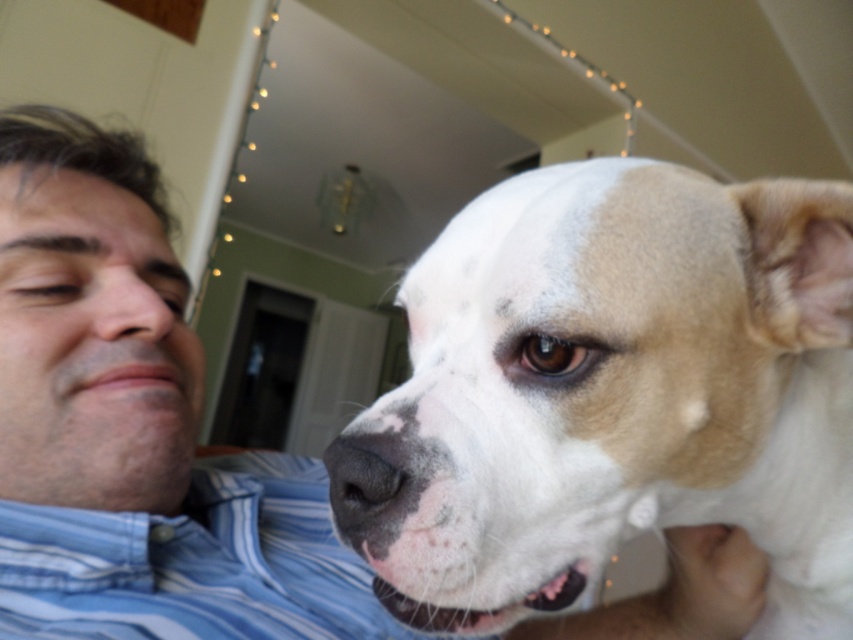
Is the position of blue striped shirt at lower left more distant than that of matte skin nose at left?

No, blue striped shirt at lower left is in front of matte skin nose at left.

Is point (1, 506) in front of point (102, 324)?

Yes, point (1, 506) is closer to viewer.

The height and width of the screenshot is (640, 853). What do you see at coordinates (193, 563) in the screenshot?
I see `blue striped shirt at lower left` at bounding box center [193, 563].

I want to click on blue striped shirt at lower left, so click(193, 563).

Who is taller, white fur dog at right or blue striped shirt at lower left?

Standing taller between the two is white fur dog at right.

Which is in front, point (820, 483) or point (202, 465)?

Point (820, 483)

Between point (779, 280) and point (202, 552), which one is positioned behind?

The point (202, 552) is more distant.

Locate an element on the screen. white fur dog at right is located at coordinates (612, 394).

Consider the image. Is white fur dog at right above matte skin nose at left?

Incorrect, white fur dog at right is not positioned above matte skin nose at left.

Is white fur dog at right positioned in front of matte skin nose at left?

Yes, it is in front of matte skin nose at left.

The image size is (853, 640). I want to click on white fur dog at right, so click(x=612, y=394).

You are a GUI agent. You are given a task and a screenshot of the screen. Output one action in this format:
    pyautogui.click(x=<x>, y=<y>)
    Task: Click on the white fur dog at right
    The width and height of the screenshot is (853, 640).
    Given the screenshot: What is the action you would take?
    pyautogui.click(x=612, y=394)